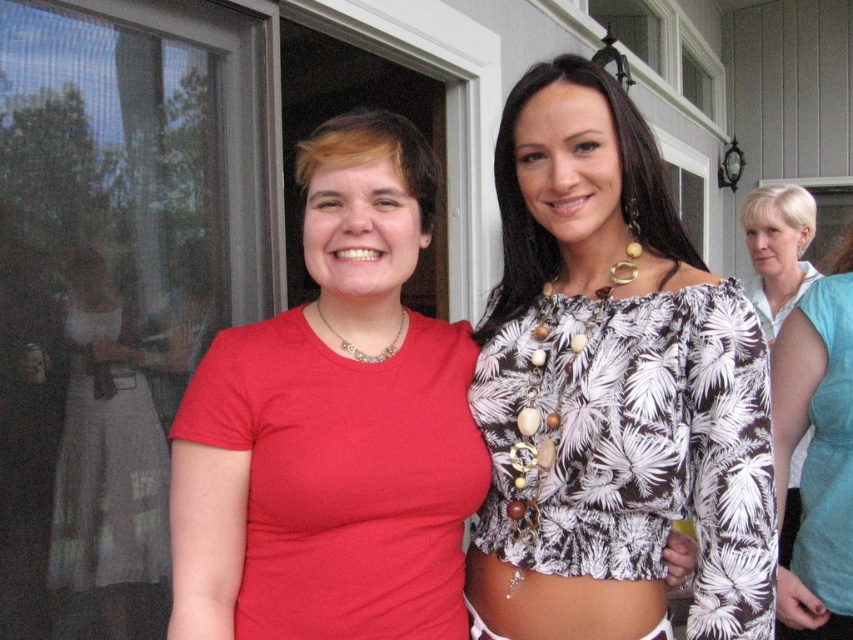
Question: In this image, where is teal fabric dress at right located relative to light blue fabric dress at right?

Choices:
 (A) right
 (B) left

Answer: (B)

Question: Which object is closer to the camera taking this photo?

Choices:
 (A) transparent glass screen door at upper center
 (B) teal fabric dress at right
 (C) light blue fabric dress at right

Answer: (B)

Question: Considering the real-world distances, which object is closest to the transparent glass screen door at upper center?

Choices:
 (A) light blue fabric dress at right
 (B) printed fabric top at center
 (C) matte red t-shirt at center

Answer: (A)

Question: Is matte red t-shirt at center to the right of white lace dress at left from the viewer's perspective?

Choices:
 (A) no
 (B) yes

Answer: (B)

Question: Which of the following is the farthest from the observer?

Choices:
 (A) matte red t-shirt at center
 (B) light blue fabric dress at right
 (C) printed fabric top at center
 (D) white lace dress at left

Answer: (B)

Question: Can you confirm if printed fabric top at center is bigger than white lace dress at left?

Choices:
 (A) no
 (B) yes

Answer: (B)